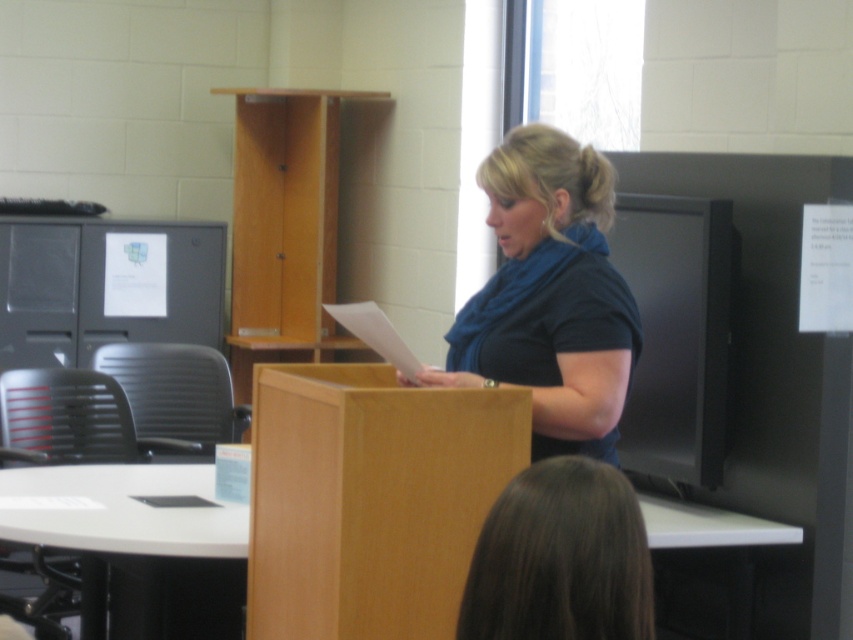
Is blue matte scarf at center shorter than brown hair at lower center?

No.

Who is positioned more to the left, blue matte scarf at center or brown hair at lower center?

brown hair at lower center

Is point (532, 202) less distant than point (531, 552)?

No, (532, 202) is behind (531, 552).

This screenshot has height=640, width=853. What are the coordinates of `blue matte scarf at center` in the screenshot? It's located at (550, 296).